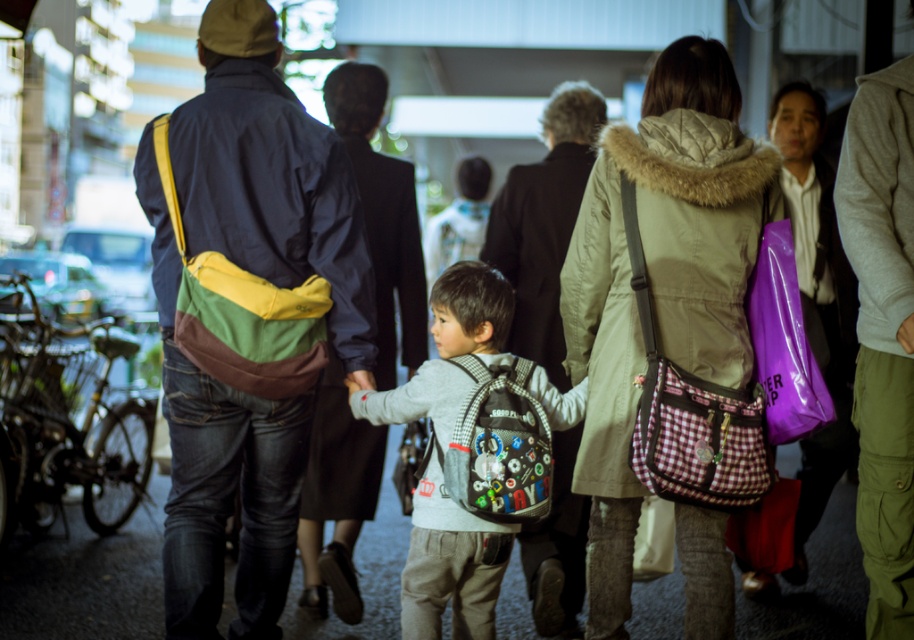
Question: Which is nearer to the gray fabric backpack at center?

Choices:
 (A) light brown leather jacket at right
 (B) multicolored fabric bag at left
 (C) matte black jacket at center

Answer: (B)

Question: Can you confirm if multicolored fabric bag at left is smaller than matte black jacket at center?

Choices:
 (A) no
 (B) yes

Answer: (B)

Question: Estimate the real-world distances between objects in this image. Which object is farther from the light brown leather jacket at right?

Choices:
 (A) dark blue jacket at center
 (B) matte black jacket at center
 (C) gray fabric backpack at center
 (D) multicolored fabric bag at left

Answer: (D)

Question: Is multicolored fabric bag at left further to camera compared to dark blue jacket at center?

Choices:
 (A) yes
 (B) no

Answer: (B)

Question: Is dark blue jacket at center above matte black jacket at center?

Choices:
 (A) no
 (B) yes

Answer: (B)

Question: Among these objects, which one is nearest to the camera?

Choices:
 (A) matte black jacket at center
 (B) light brown leather jacket at right
 (C) gray fabric backpack at center
 (D) multicolored fabric bag at left

Answer: (D)